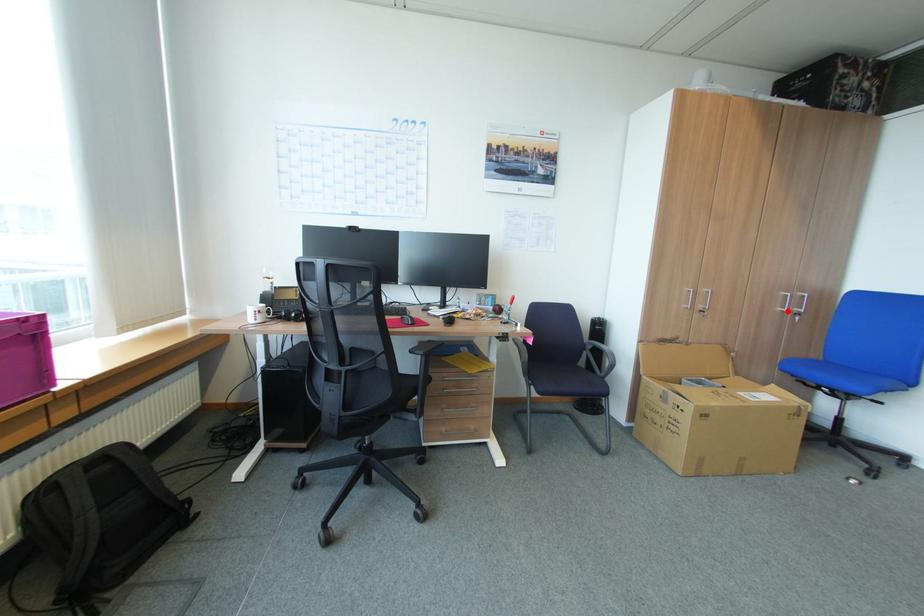
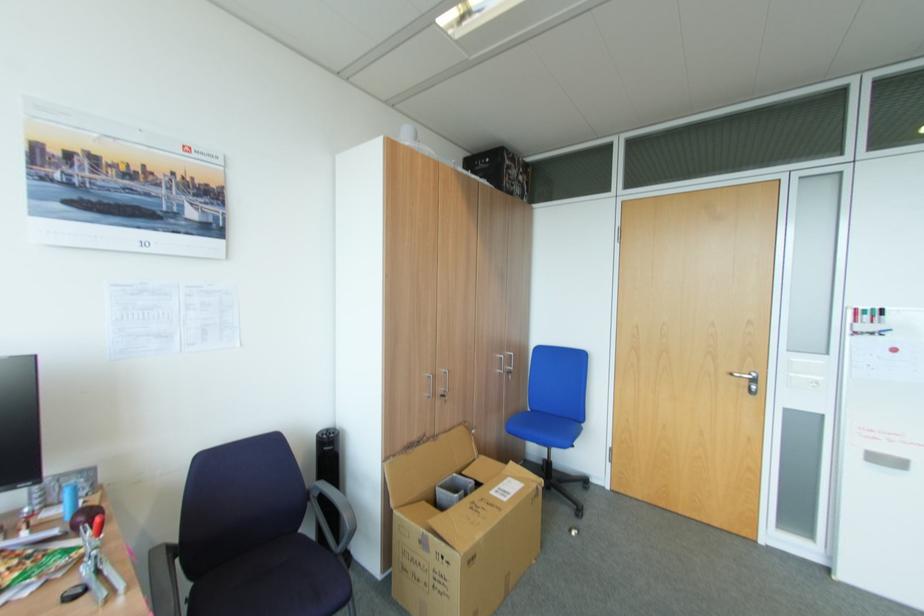
Question: I am providing you with two images of the same scene from different viewpoints. In image1, a red point is highlighted. Considering the same 3D point in image2, which of the following is correct?

Choices:
 (A) It is closer
 (B) It is farther

Answer: (B)